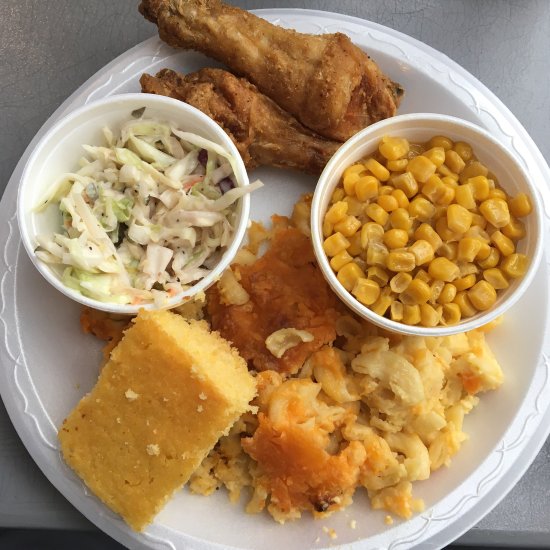
Find the location of a particular element. The width and height of the screenshot is (550, 550). plate is located at coordinates (392, 47).